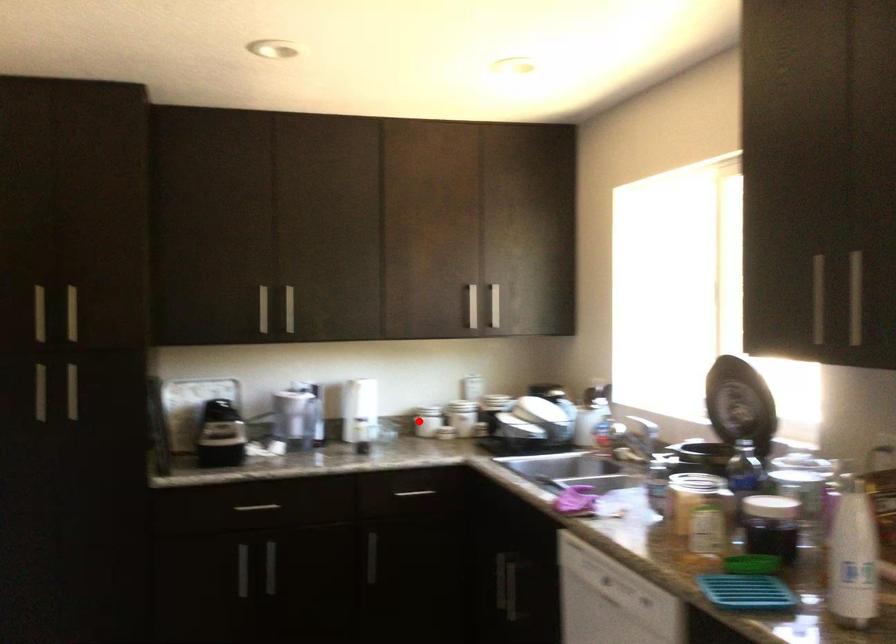
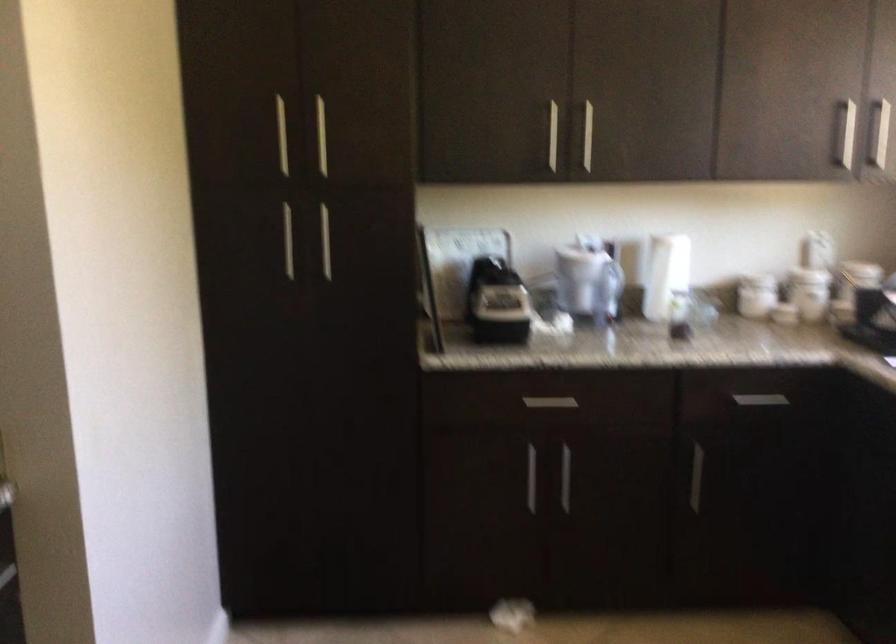
In the second image, find the point that corresponds to the highlighted location in the first image.

(755, 295)